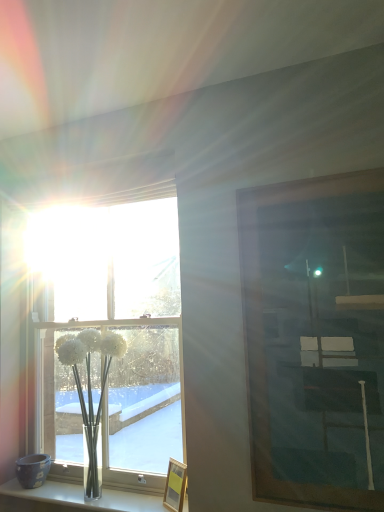
Question: Does clear glass vase at lower left come behind white glass vase at lower left?

Choices:
 (A) no
 (B) yes

Answer: (A)

Question: Is clear glass vase at lower left looking in the opposite direction of white glass vase at lower left?

Choices:
 (A) no
 (B) yes

Answer: (A)

Question: Is white glass vase at lower left completely or partially inside clear glass vase at lower left?

Choices:
 (A) yes
 (B) no

Answer: (B)

Question: Considering the relative positions of clear glass vase at lower left and white glass vase at lower left in the image provided, is clear glass vase at lower left to the right of white glass vase at lower left from the viewer's perspective?

Choices:
 (A) no
 (B) yes

Answer: (A)

Question: Is clear glass vase at lower left far from white glass vase at lower left?

Choices:
 (A) yes
 (B) no

Answer: (B)

Question: Is wooden picture frame at right, acting as the first picture frame starting from the front, taller or shorter than wooden picture frame at lower center, placed as the 1th picture frame when sorted from back to front?

Choices:
 (A) short
 (B) tall

Answer: (B)

Question: Is wooden picture frame at right, placed as the second picture frame when sorted from back to front, inside the boundaries of wooden picture frame at lower center, which appears as the first picture frame when ordered from the bottom, or outside?

Choices:
 (A) outside
 (B) inside

Answer: (A)

Question: Based on their positions, is wooden picture frame at right, the first picture frame in the right-to-left sequence, located to the left or right of wooden picture frame at lower center, the first picture frame when ordered from left to right?

Choices:
 (A) left
 (B) right

Answer: (B)

Question: Is wooden picture frame at right, placed as the second picture frame when sorted from back to front, wider or thinner than wooden picture frame at lower center, which appears as the first picture frame when ordered from the bottom?

Choices:
 (A) thin
 (B) wide

Answer: (B)

Question: From a real-world perspective, relative to wooden picture frame at right, acting as the first picture frame starting from the front, is white glass vase at lower left vertically above or below?

Choices:
 (A) below
 (B) above

Answer: (A)

Question: Choose the correct answer: Is white glass vase at lower left inside wooden picture frame at right, which ranks as the second picture frame in bottom-to-top order, or outside it?

Choices:
 (A) outside
 (B) inside

Answer: (A)

Question: Considering the positions of white glass vase at lower left and wooden picture frame at right, acting as the first picture frame starting from the front, in the image, is white glass vase at lower left wider or thinner than wooden picture frame at right, acting as the first picture frame starting from the front,?

Choices:
 (A) wide
 (B) thin

Answer: (A)

Question: Based on their sizes in the image, would you say white glass vase at lower left is bigger or smaller than wooden picture frame at right, the 1th picture frame viewed from the top?

Choices:
 (A) small
 (B) big

Answer: (B)

Question: In the image, is clear glass vase at lower left positioned in front of or behind wooden picture frame at lower center, which appears as the first picture frame when ordered from the bottom?

Choices:
 (A) front
 (B) behind

Answer: (A)

Question: Is clear glass vase at lower left bigger or smaller than wooden picture frame at lower center, the 2th picture frame viewed from the front?

Choices:
 (A) small
 (B) big

Answer: (B)